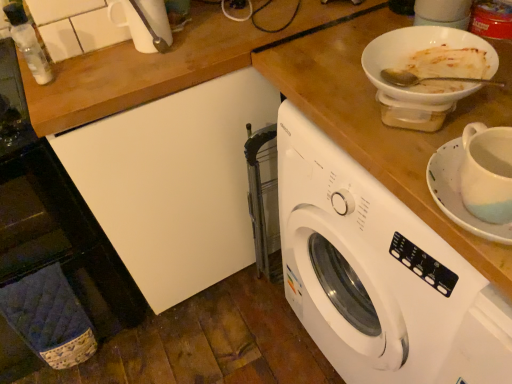
Locate an element on the screen. The width and height of the screenshot is (512, 384). free location to the right of transparent plastic bottle at upper left is located at coordinates (80, 53).